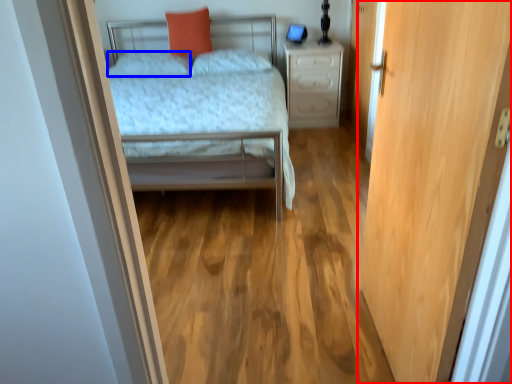
Question: Which object is closer to the camera taking this photo, door (highlighted by a red box) or pillow (highlighted by a blue box)?

Choices:
 (A) door
 (B) pillow

Answer: (A)